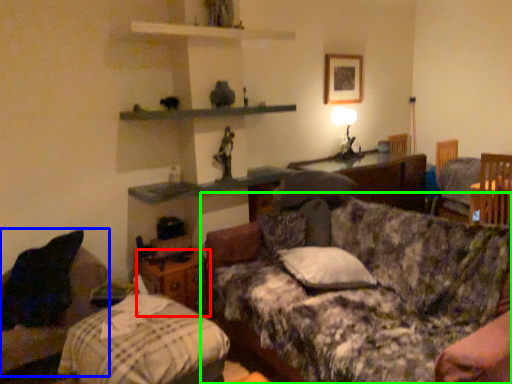
Question: Based on their relative distances, which object is farther from nightstand (highlighted by a red box)? Choose from furniture (highlighted by a blue box) and studio couch (highlighted by a green box).

Choices:
 (A) furniture
 (B) studio couch

Answer: (B)